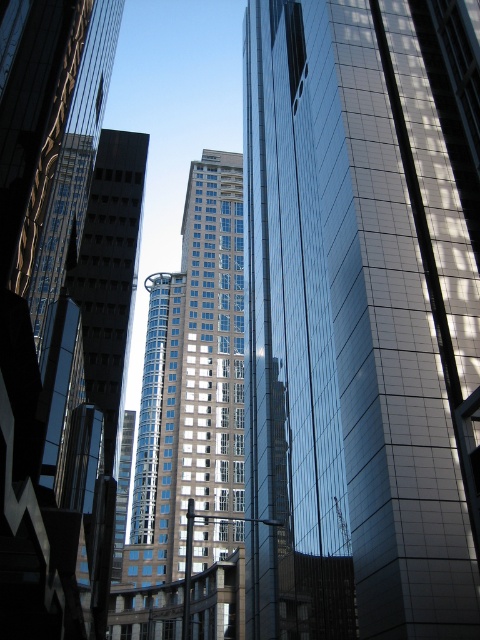
Can you confirm if shiny glass skyscraper at center is positioned to the left of glassy blue skyscraper at center?

Incorrect, shiny glass skyscraper at center is not on the left side of glassy blue skyscraper at center.

Who is higher up, shiny glass skyscraper at center or glassy blue skyscraper at center?

Positioned higher is shiny glass skyscraper at center.

Between point (432, 24) and point (213, 356), which one is positioned behind?

Point (213, 356)

This screenshot has width=480, height=640. What are the coordinates of `shiny glass skyscraper at center` in the screenshot? It's located at (361, 316).